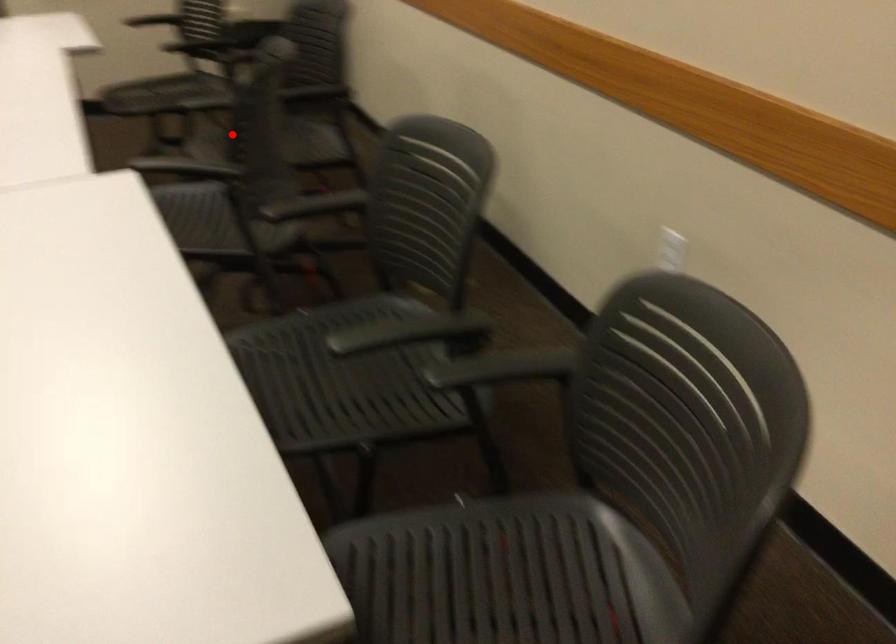
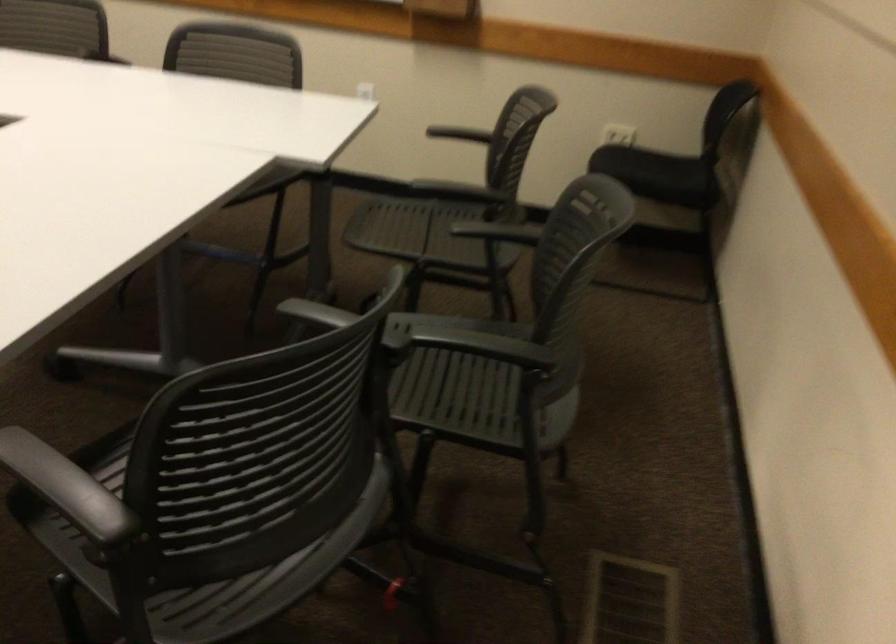
Where in the second image is the point corresponding to the highlighted location from the first image?

(141, 440)